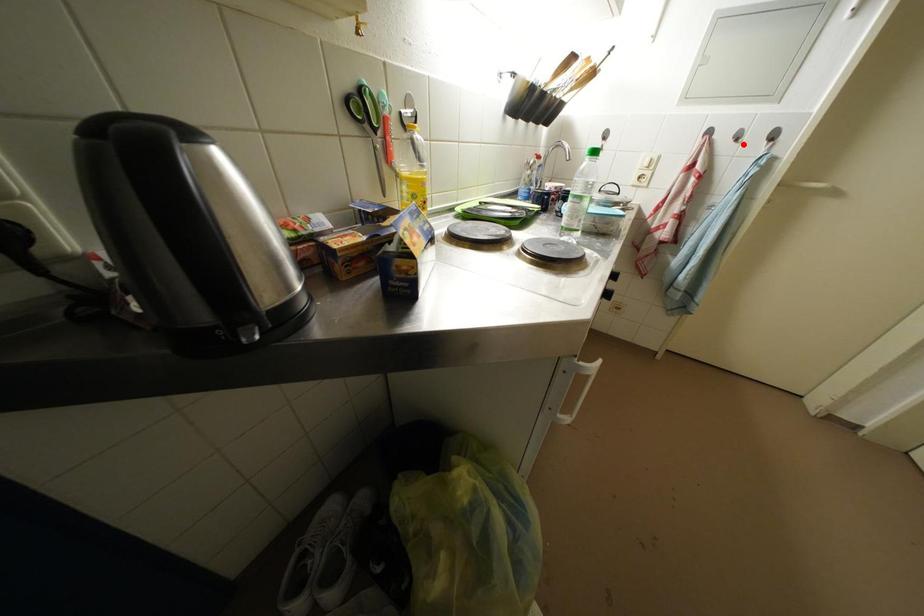
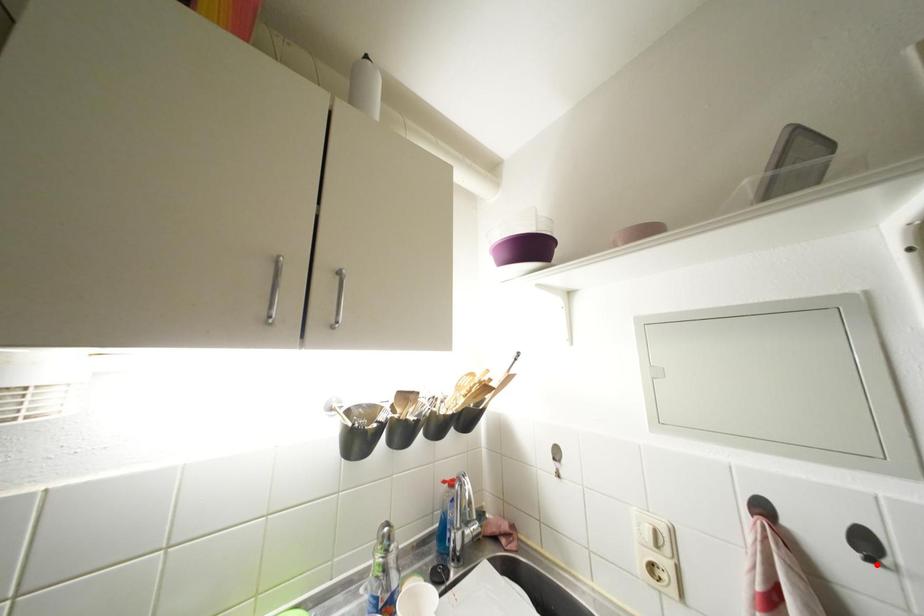
I am providing you with two images of the same scene from different viewpoints. A red point is marked on the first image and another point is marked on the second image. Is the red point in image1 aligned with the point shown in image2?

Yes